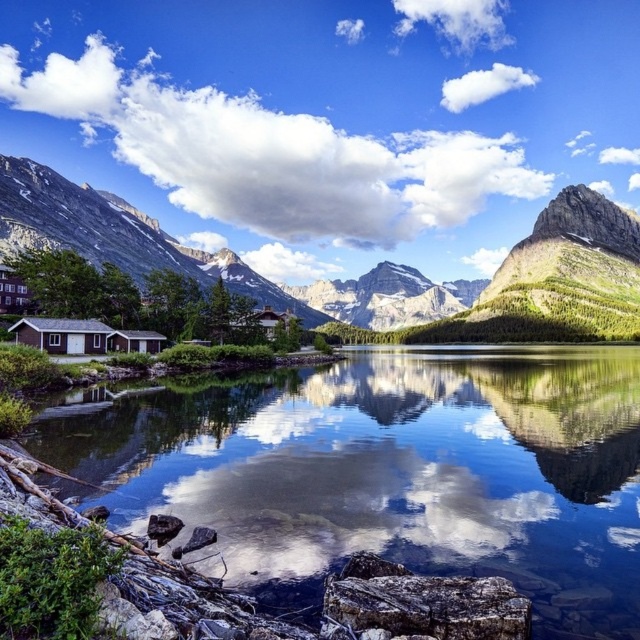
Consider the image. Is clear glass water at center smaller than green grassy mountain at center?

Yes, clear glass water at center is smaller than green grassy mountain at center.

Where is `clear glass water at center`? Image resolution: width=640 pixels, height=640 pixels. clear glass water at center is located at coordinates (388, 470).